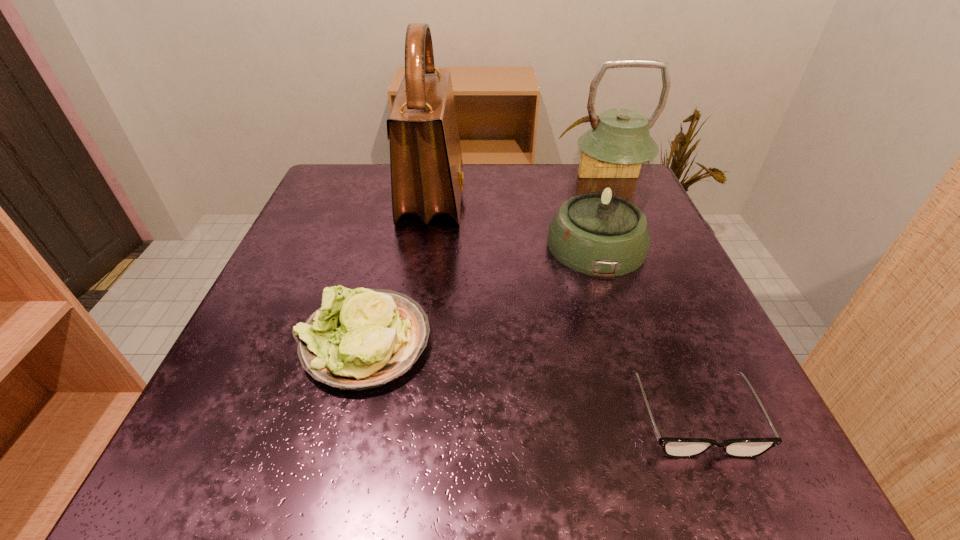
Locate an element on the screen. The height and width of the screenshot is (540, 960). free space that satisfies the following two spatial constraints: 1. on the front flap of the lantern; 2. on the left side of the shoulder bag is located at coordinates [426, 244].